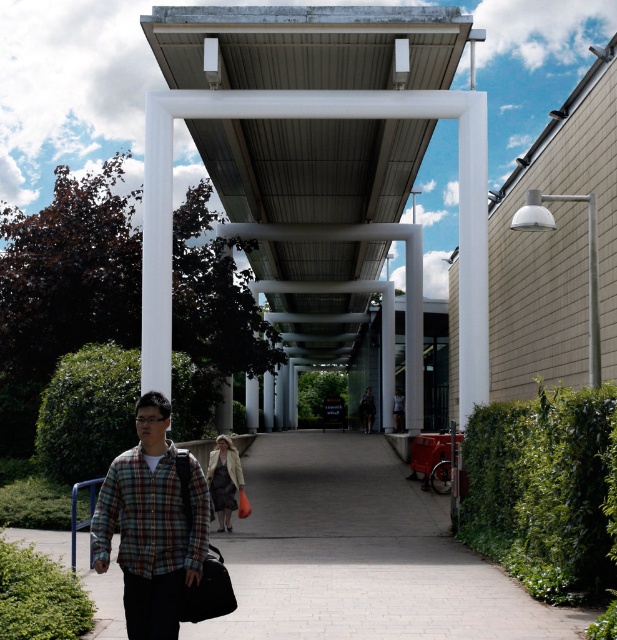
Question: Can you confirm if plaid flannel shirt at lower left is positioned below dark gray fabric jacket at center?

Choices:
 (A) no
 (B) yes

Answer: (A)

Question: Among these points, which one is farthest from the camera?

Choices:
 (A) (101, 486)
 (B) (365, 419)

Answer: (B)

Question: Can you confirm if plaid flannel shirt at lower left is bigger than dark gray fabric jacket at center?

Choices:
 (A) no
 (B) yes

Answer: (A)

Question: Can you confirm if plaid flannel shirt at lower left is bigger than dark gray fabric jacket at center?

Choices:
 (A) no
 (B) yes

Answer: (A)

Question: Which object is farther from the camera taking this photo?

Choices:
 (A) dark gray fabric jacket at center
 (B) plaid flannel shirt at lower left

Answer: (A)